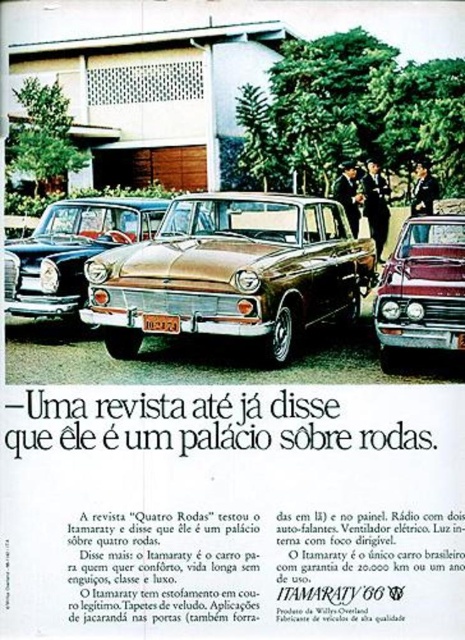
Does gold metallic sedan at center lie behind yellow plastic license plate at center?

That is True.

Is gold metallic sedan at center smaller than yellow plastic license plate at center?

No.

Is point (66, 305) farther from viewer compared to point (154, 320)?

Yes.

Locate an element on the screen. This screenshot has height=640, width=465. gold metallic sedan at center is located at coordinates (71, 250).

Is gold metallic car at center to the right of gold metallic sedan at center from the viewer's perspective?

Indeed, gold metallic car at center is positioned on the right side of gold metallic sedan at center.

What do you see at coordinates (233, 272) in the screenshot? Image resolution: width=465 pixels, height=640 pixels. I see `gold metallic car at center` at bounding box center [233, 272].

Between point (166, 296) and point (57, 296), which one is positioned in front?

Point (166, 296)

This screenshot has height=640, width=465. I want to click on gold metallic car at center, so click(x=233, y=272).

Is shiny maroon sedan at right positioned behind yellow plastic license plate at center?

That is False.

Does shiny maroon sedan at right have a smaller size compared to yellow plastic license plate at center?

No, shiny maroon sedan at right is not smaller than yellow plastic license plate at center.

Locate an element on the screen. This screenshot has height=640, width=465. shiny maroon sedan at right is located at coordinates (422, 289).